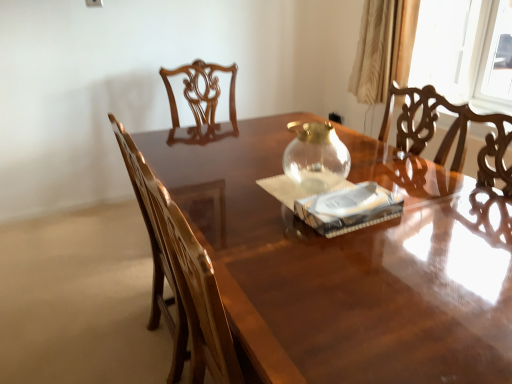
At what (x,y) coordinates should I click in order to perform the action: click on vacant space in between white paper at center and transparent glass teapot at center. Please return your answer as a coordinate pair (x, y). Image resolution: width=512 pixels, height=384 pixels. Looking at the image, I should click on (289, 187).